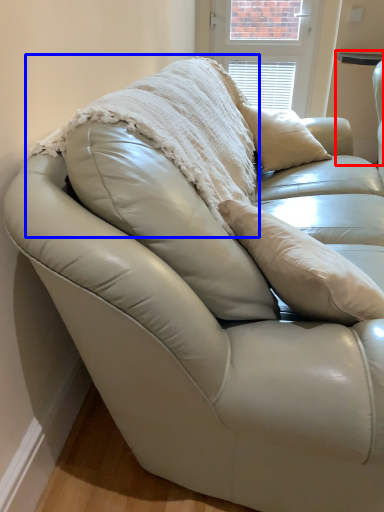
Question: Which object is further to the camera taking this photo, table (highlighted by a red box) or blanket (highlighted by a blue box)?

Choices:
 (A) table
 (B) blanket

Answer: (A)